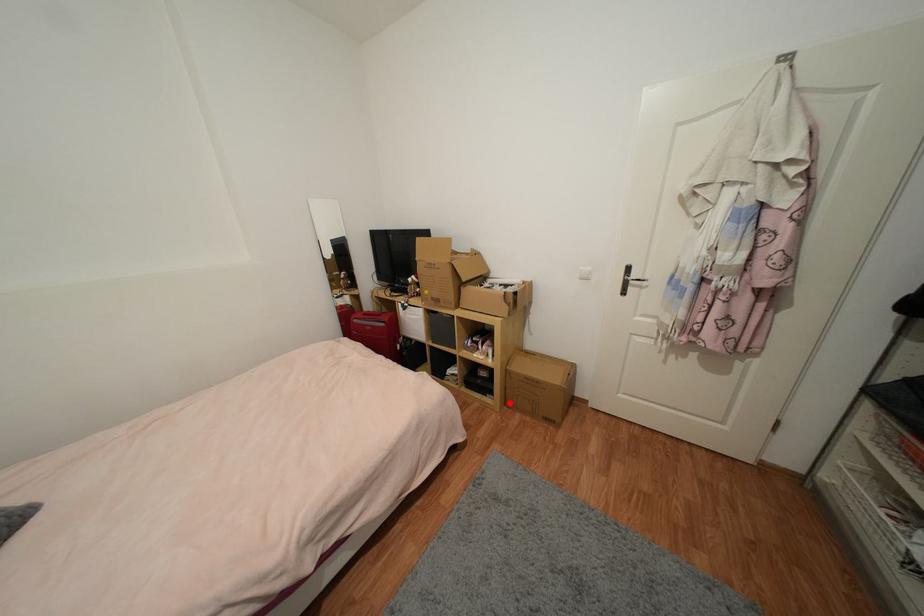
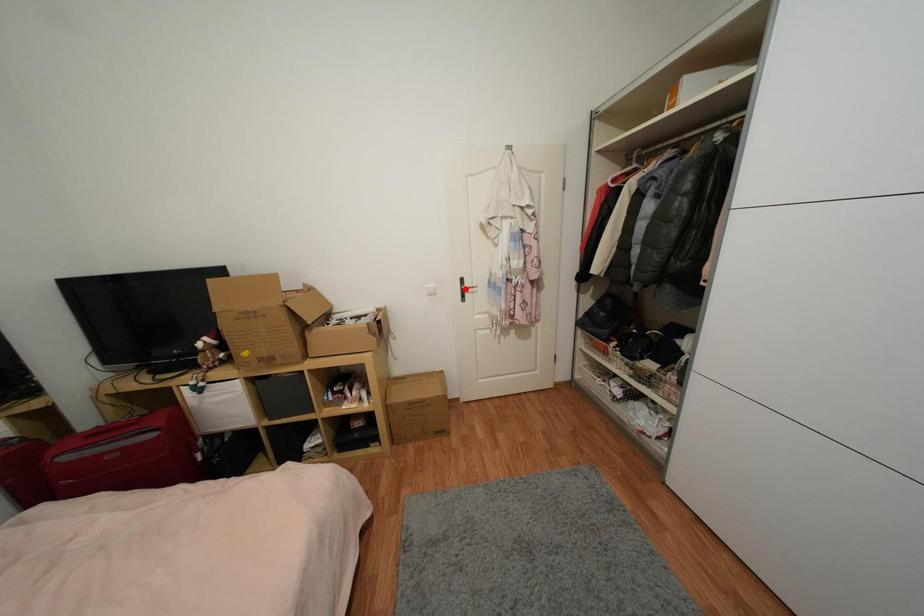
I am providing you with two images of the same scene from different viewpoints. A red point is marked on the first image and another point is marked on the second image. Are the points marked in image1 and image2 representing the same 3D position?

No